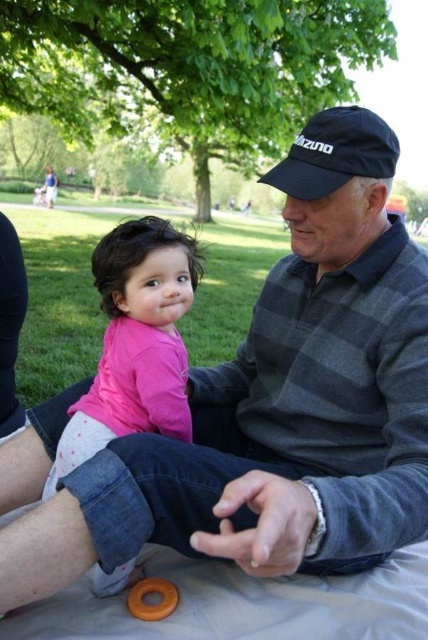
Does pink matte shirt at center come behind black fabric baseball cap at upper center?

That is False.

Can you confirm if pink matte shirt at center is thinner than black fabric baseball cap at upper center?

Correct, pink matte shirt at center's width is less than black fabric baseball cap at upper center's.

Find the location of a particular element. pink matte shirt at center is located at coordinates (134, 342).